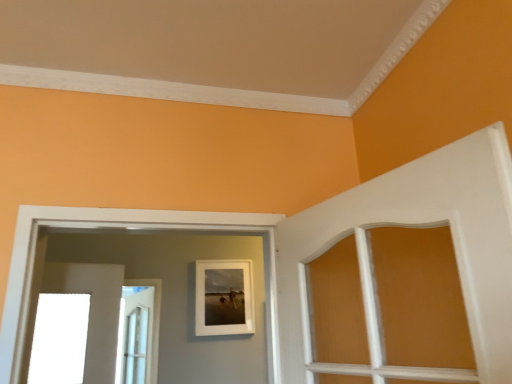
What do you see at coordinates (224, 298) in the screenshot?
I see `white matte picture frame at center` at bounding box center [224, 298].

The width and height of the screenshot is (512, 384). In order to click on white matte picture frame at center in this screenshot , I will do `click(224, 298)`.

Measure the distance between white matte picture frame at center and camera.

The depth of white matte picture frame at center is 9.72 feet.

What do you see at coordinates (93, 310) in the screenshot? The width and height of the screenshot is (512, 384). I see `white glossy door at left` at bounding box center [93, 310].

The width and height of the screenshot is (512, 384). In order to click on white glossy door at left in this screenshot , I will do `click(93, 310)`.

Find the location of a particular element. white matte picture frame at center is located at coordinates (224, 298).

Considering the relative positions of white matte picture frame at center and white glossy door at left in the image provided, is white matte picture frame at center to the left or to the right of white glossy door at left?

From the image, it's evident that white matte picture frame at center is to the right of white glossy door at left.

Is white matte picture frame at center behind white glossy door at left?

No, it is in front of white glossy door at left.

Considering the positions of point (197, 327) and point (44, 270), is point (197, 327) closer or farther from the camera than point (44, 270)?

Point (197, 327) is farther from the camera than point (44, 270).

From the image's perspective, which object appears higher, white matte picture frame at center or white glossy door at left?

white matte picture frame at center is shown above in the image.

From a real-world perspective, is white matte picture frame at center located beneath white glossy door at left?

No, from a real-world perspective, white matte picture frame at center is not below white glossy door at left.

Which object is thinner, white matte picture frame at center or white glossy door at left?

With smaller width is white glossy door at left.

Considering the sizes of objects white matte picture frame at center and white glossy door at left in the image provided, who is shorter, white matte picture frame at center or white glossy door at left?

With less height is white matte picture frame at center.

Does white matte picture frame at center have a larger size compared to white glossy door at left?

Yes, white matte picture frame at center is bigger than white glossy door at left.

Can we say white matte picture frame at center lies outside white glossy door at left?

That's correct, white matte picture frame at center is outside of white glossy door at left.

Can you see white matte picture frame at center touching white glossy door at left?

No, white matte picture frame at center is not making contact with white glossy door at left.

Could you tell me if white matte picture frame at center is facing white glossy door at left?

No.

Where is `door that appears below the white matte picture frame at center (from a real-world perspective)`? This screenshot has height=384, width=512. door that appears below the white matte picture frame at center (from a real-world perspective) is located at coordinates (93, 310).

Can you confirm if white glossy door at left is positioned to the left of white matte picture frame at center?

Yes, white glossy door at left is to the left of white matte picture frame at center.

Considering the positions of objects white glossy door at left and white matte picture frame at center in the image provided, who is in front, white glossy door at left or white matte picture frame at center?

white matte picture frame at center is closer to the camera.

Is point (55, 263) more distant than point (214, 310)?

No, it is not.

From the image's perspective, is white glossy door at left positioned above or below white matte picture frame at center?

white glossy door at left is situated lower than white matte picture frame at center in the image.

From a real-world perspective, is white glossy door at left over white matte picture frame at center?

No, from a real-world perspective, white glossy door at left is not over white matte picture frame at center

Considering the sizes of objects white glossy door at left and white matte picture frame at center in the image provided, who is thinner, white glossy door at left or white matte picture frame at center?

white glossy door at left is thinner.

Is white glossy door at left taller than white matte picture frame at center?

Yes.

Considering the sizes of objects white glossy door at left and white matte picture frame at center in the image provided, who is bigger, white glossy door at left or white matte picture frame at center?

white matte picture frame at center is bigger.

Is white glossy door at left inside the boundaries of white matte picture frame at center, or outside?

white glossy door at left is located beyond the bounds of white matte picture frame at center.

From the picture: Can you see white glossy door at left touching white matte picture frame at center?

There is a gap between white glossy door at left and white matte picture frame at center.

Is white glossy door at left positioned with its back to white matte picture frame at center?

No.

How distant is white glossy door at left from white matte picture frame at center?

The distance of white glossy door at left from white matte picture frame at center is 38.13 inches.

Find the location of a particular element. The height and width of the screenshot is (384, 512). door below the white matte picture frame at center (from the image's perspective) is located at coordinates click(93, 310).

Where is `door that is under the white matte picture frame at center (from a real-world perspective)`? door that is under the white matte picture frame at center (from a real-world perspective) is located at coordinates (93, 310).

This screenshot has height=384, width=512. In order to click on picture frame to the right of white glossy door at left in this screenshot , I will do `click(224, 298)`.